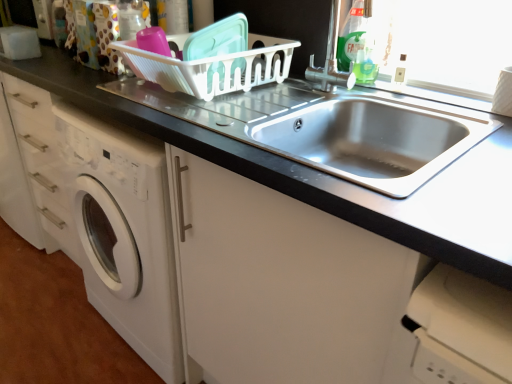
Describe the element at coordinates (331, 59) in the screenshot. I see `satin nickel faucet at upper right` at that location.

Describe the element at coordinates (372, 140) in the screenshot. Image resolution: width=512 pixels, height=384 pixels. I see `stainless steel sink at center` at that location.

What do you see at coordinates (280, 283) in the screenshot? I see `stainless steel sink at center` at bounding box center [280, 283].

Identify the location of white plastic basket at upper center. (213, 67).

Looking at this image, is green plastic bottle at upper right smaller than stainless steel sink at center?

Indeed, green plastic bottle at upper right has a smaller size compared to stainless steel sink at center.

Would you say green plastic bottle at upper right is a long distance from stainless steel sink at center?

No.

Between green plastic bottle at upper right and stainless steel sink at center, which one has less height?

green plastic bottle at upper right.

How different are the orientations of green plastic bottle at upper right and stainless steel sink at center in degrees?

27.3 degrees separate the facing orientations of green plastic bottle at upper right and stainless steel sink at center.

Could you tell me if green plastic bottle at upper right is facing satin nickel faucet at upper right?

No, green plastic bottle at upper right is not turned towards satin nickel faucet at upper right.

Between green plastic bottle at upper right and satin nickel faucet at upper right, which one has more height?

With more height is green plastic bottle at upper right.

The image size is (512, 384). I want to click on cleaning product above the satin nickel faucet at upper right (from a real-world perspective), so click(353, 33).

Is point (347, 68) positioned after point (334, 56)?

No, (347, 68) is closer to viewer.

How distant is stainless steel sink at center from green plastic bottle at upper right?

A distance of 13.84 inches exists between stainless steel sink at center and green plastic bottle at upper right.

From a real-world perspective, which object rests below the other?

stainless steel sink at center is physically lower.

Is stainless steel sink at center touching green plastic bottle at upper right?

No.

Can you tell me how much stainless steel sink at center and green plastic bottle at upper right differ in facing direction?

The facing directions of stainless steel sink at center and green plastic bottle at upper right are 27.3 degrees apart.

Is stainless steel sink at center in front of or behind stainless steel sink at center in the image?

In the image, stainless steel sink at center appears behind stainless steel sink at center.

From the image's perspective, would you say stainless steel sink at center is positioned over stainless steel sink at center?

Yes, from the image's perspective, stainless steel sink at center is above stainless steel sink at center.

What are the coordinates of `sink that appears above the stainless steel sink at center (from the image's perspective)` in the screenshot? It's located at (372, 140).

Consider the image. Is stainless steel sink at center not within white plastic basket at upper center?

Yes, stainless steel sink at center is outside of white plastic basket at upper center.

Can you confirm if stainless steel sink at center is taller than white plastic basket at upper center?

Yes.

Which is more to the left, stainless steel sink at center or white plastic basket at upper center?

white plastic basket at upper center.

Where is `sink below the white plastic basket at upper center (from the image's perspective)`? This screenshot has height=384, width=512. sink below the white plastic basket at upper center (from the image's perspective) is located at coordinates (372, 140).

In the scene shown: Is satin nickel faucet at upper right in front of or behind green plastic bottle at upper right in the image?

Visually, satin nickel faucet at upper right is located behind green plastic bottle at upper right.

Can you confirm if satin nickel faucet at upper right is shorter than green plastic bottle at upper right?

Correct, satin nickel faucet at upper right is not as tall as green plastic bottle at upper right.

Find the location of a particular element. This screenshot has height=384, width=512. cleaning product on the right of satin nickel faucet at upper right is located at coordinates (353, 33).

Can you confirm if satin nickel faucet at upper right is positioned to the left of green plastic bottle at upper right?

Indeed, satin nickel faucet at upper right is positioned on the left side of green plastic bottle at upper right.

Considering the sizes of objects stainless steel sink at center and green plastic bottle at upper right in the image provided, who is shorter, stainless steel sink at center or green plastic bottle at upper right?

green plastic bottle at upper right.

From a real-world perspective, is stainless steel sink at center above or below green plastic bottle at upper right?

stainless steel sink at center is below green plastic bottle at upper right.

Could you tell me if stainless steel sink at center is facing green plastic bottle at upper right?

No, stainless steel sink at center is not oriented towards green plastic bottle at upper right.

At what (x,y) coordinates should I click in order to perform the action: click on cabinetry below the green plastic bottle at upper right (from the image's perspective). Please return your answer as a coordinate pair (x, y). Looking at the image, I should click on (280, 283).

Identify the location of cleaning product that is on the right side of satin nickel faucet at upper right. (353, 33).

Looking at the image, which one is located closer to satin nickel faucet at upper right, stainless steel sink at center or stainless steel sink at center?

stainless steel sink at center is closer to satin nickel faucet at upper right.

Based on their spatial positions, is stainless steel sink at center or satin nickel faucet at upper right closer to green plastic bottle at upper right?

satin nickel faucet at upper right lies closer to green plastic bottle at upper right than the other object.

Based on their spatial positions, is satin nickel faucet at upper right or stainless steel sink at center further from green plastic bottle at upper right?

stainless steel sink at center is positioned further to the anchor green plastic bottle at upper right.

Looking at the image, which one is located closer to green plastic bottle at upper right, stainless steel sink at center or stainless steel sink at center?

Based on the image, stainless steel sink at center appears to be nearer to green plastic bottle at upper right.

Based on their spatial positions, is stainless steel sink at center or green plastic bottle at upper right further from stainless steel sink at center?

Based on the image, green plastic bottle at upper right appears to be further to stainless steel sink at center.

When comparing their distances from satin nickel faucet at upper right, does white plastic basket at upper center or stainless steel sink at center seem closer?

white plastic basket at upper center.

From the image, which object appears to be nearer to satin nickel faucet at upper right, white plastic basket at upper center or green plastic bottle at upper right?

green plastic bottle at upper right is closer to satin nickel faucet at upper right.

Which object lies nearer to the anchor point stainless steel sink at center, green plastic bottle at upper right or white plastic basket at upper center?

The object closer to stainless steel sink at center is white plastic basket at upper center.

This screenshot has width=512, height=384. I want to click on cleaning product located between stainless steel sink at center and satin nickel faucet at upper right in the depth direction, so click(x=353, y=33).

Identify the location of sink between satin nickel faucet at upper right and stainless steel sink at center from top to bottom. The image size is (512, 384). (372, 140).

The width and height of the screenshot is (512, 384). In order to click on faucet situated between white plastic basket at upper center and green plastic bottle at upper right from left to right in this screenshot , I will do `click(331, 59)`.

You are a GUI agent. You are given a task and a screenshot of the screen. Output one action in this format:
    pyautogui.click(x=<x>, y=<y>)
    Task: Click on the faucet between green plastic bottle at upper right and stainless steel sink at center in the vertical direction
    This screenshot has height=384, width=512.
    Given the screenshot: What is the action you would take?
    pyautogui.click(x=331, y=59)